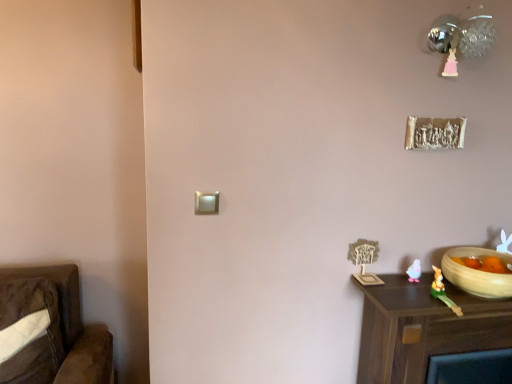
What do you see at coordinates (477, 273) in the screenshot?
I see `beige ceramic bowl at lower right` at bounding box center [477, 273].

Describe the element at coordinates (414, 271) in the screenshot. I see `pink plastic toy at lower right, marked as the first toy in a back-to-front arrangement` at that location.

Where is `metallic sphere at upper right`? This screenshot has width=512, height=384. metallic sphere at upper right is located at coordinates (460, 38).

Which is in front, point (489, 336) or point (486, 26)?

The point (486, 26) is more forward.

Is brown wood nightstand at lower right inside the boundaries of metallic sphere at upper right, or outside?

brown wood nightstand at lower right cannot be found inside metallic sphere at upper right.

Based on the photo, which of these two, brown wood nightstand at lower right or metallic sphere at upper right, stands taller?

With more height is brown wood nightstand at lower right.

Which is correct: beige ceramic bowl at lower right is inside pink plastic toy at lower right, marked as the first toy in a back-to-front arrangement, or outside of it?

beige ceramic bowl at lower right is outside pink plastic toy at lower right, marked as the first toy in a back-to-front arrangement.

Measure the distance between beige ceramic bowl at lower right and pink plastic toy at lower right, the 2th toy when ordered from front to back.

A distance of 20.96 centimeters exists between beige ceramic bowl at lower right and pink plastic toy at lower right, the 2th toy when ordered from front to back.

Looking at this image, which is behind, beige ceramic bowl at lower right or pink plastic toy at lower right, the 2th toy when ordered from front to back?

pink plastic toy at lower right, the 2th toy when ordered from front to back.

From a real-world perspective, is metallic sphere at upper right above or below pink plastic toy at lower right, the 2th toy when ordered from front to back?

In terms of real-world spatial position, metallic sphere at upper right is above pink plastic toy at lower right, the 2th toy when ordered from front to back.

Would you say pink plastic toy at lower right, the 2th toy when ordered from front to back, is part of metallic sphere at upper right's contents?

Definitely not — pink plastic toy at lower right, the 2th toy when ordered from front to back, is not inside metallic sphere at upper right.

In terms of height, does metallic sphere at upper right look taller or shorter compared to pink plastic toy at lower right, marked as the first toy in a back-to-front arrangement?

Clearly, metallic sphere at upper right is taller compared to pink plastic toy at lower right, marked as the first toy in a back-to-front arrangement.

Does point (478, 18) appear closer or farther from the camera than point (414, 273)?

Point (478, 18) is closer to the camera than point (414, 273).

Is brown wood nightstand at lower right facing towards beige ceramic bowl at lower right?

No, brown wood nightstand at lower right is not oriented towards beige ceramic bowl at lower right.

What's the angular difference between brown wood nightstand at lower right and beige ceramic bowl at lower right's facing directions?

The facing directions of brown wood nightstand at lower right and beige ceramic bowl at lower right are 0.721 degrees apart.

Is brown wood nightstand at lower right not inside beige ceramic bowl at lower right?

Yes.

Is brown wood nightstand at lower right far from beige ceramic bowl at lower right?

That's not correct — brown wood nightstand at lower right is a little close to beige ceramic bowl at lower right.

Which object is thinner, pink plastic toy at lower right, the 2th toy when ordered from front to back, or brown wood nightstand at lower right?

Thinner between the two is pink plastic toy at lower right, the 2th toy when ordered from front to back.

From a real-world perspective, who is located lower, pink plastic toy at lower right, marked as the first toy in a back-to-front arrangement, or brown wood nightstand at lower right?

From a 3D spatial view, brown wood nightstand at lower right is below.

Does pink plastic toy at lower right, the 2th toy when ordered from front to back, lie in front of brown wood nightstand at lower right?

No, pink plastic toy at lower right, the 2th toy when ordered from front to back, is further to the viewer.

Looking at this image, which of these two, pink plastic toy at lower right, marked as the first toy in a back-to-front arrangement, or beige ceramic bowl at lower right, stands taller?

beige ceramic bowl at lower right is taller.

Is pink plastic toy at lower right, the 2th toy when ordered from front to back, in contact with beige ceramic bowl at lower right?

No, pink plastic toy at lower right, the 2th toy when ordered from front to back, is not touching beige ceramic bowl at lower right.

Which is more to the left, pink plastic toy at lower right, marked as the first toy in a back-to-front arrangement, or beige ceramic bowl at lower right?

pink plastic toy at lower right, marked as the first toy in a back-to-front arrangement, is more to the left.

Is green rubber rabbit at lower right, arranged as the 1th toy when viewed from the front, facing towards brown wood nightstand at lower right?

No, green rubber rabbit at lower right, arranged as the 1th toy when viewed from the front, is not facing towards brown wood nightstand at lower right.

In terms of size, does green rubber rabbit at lower right, which appears as the 2th toy when viewed from the back, appear bigger or smaller than brown wood nightstand at lower right?

Clearly, green rubber rabbit at lower right, which appears as the 2th toy when viewed from the back, is smaller in size than brown wood nightstand at lower right.

Can you confirm if green rubber rabbit at lower right, which appears as the 2th toy when viewed from the back, is thinner than brown wood nightstand at lower right?

Yes.

Can you confirm if green rubber rabbit at lower right, which appears as the 2th toy when viewed from the back, is positioned to the right of brown wood nightstand at lower right?

No, green rubber rabbit at lower right, which appears as the 2th toy when viewed from the back, is not to the right of brown wood nightstand at lower right.

You are a GUI agent. You are given a task and a screenshot of the screen. Output one action in this format:
    pyautogui.click(x=<x>, y=<y>)
    Task: Click on the light fixture in front of the brown wood nightstand at lower right
    
    Given the screenshot: What is the action you would take?
    click(x=460, y=38)

You are a GUI agent. You are given a task and a screenshot of the screen. Output one action in this format:
    pyautogui.click(x=<x>, y=<y>)
    Task: Click on the 2nd toy to the left of the beige ceramic bowl at lower right, counting from the anchor's position
    
    Given the screenshot: What is the action you would take?
    pyautogui.click(x=414, y=271)

Looking at the image, which one is located closer to green rubber rabbit at lower right, which appears as the 2th toy when viewed from the back, brown wood nightstand at lower right or pink plastic toy at lower right, the 2th toy when ordered from front to back?

pink plastic toy at lower right, the 2th toy when ordered from front to back, is positioned closer to the anchor green rubber rabbit at lower right, which appears as the 2th toy when viewed from the back.

Looking at the image, which one is located further to brown wood nightstand at lower right, pink plastic toy at lower right, marked as the first toy in a back-to-front arrangement, or metallic sphere at upper right?

metallic sphere at upper right is further to brown wood nightstand at lower right.

Considering their positions, is beige ceramic bowl at lower right positioned closer to pink plastic toy at lower right, the 2th toy when ordered from front to back, than brown wood nightstand at lower right?

The object closer to pink plastic toy at lower right, the 2th toy when ordered from front to back, is beige ceramic bowl at lower right.

From the image, which object appears to be farther from brown wood nightstand at lower right, beige ceramic bowl at lower right or green rubber rabbit at lower right, arranged as the 1th toy when viewed from the front?

The object further to brown wood nightstand at lower right is beige ceramic bowl at lower right.

When comparing their distances from pink plastic toy at lower right, marked as the first toy in a back-to-front arrangement, does beige ceramic bowl at lower right or green rubber rabbit at lower right, arranged as the 1th toy when viewed from the front, seem closer?

Based on the image, green rubber rabbit at lower right, arranged as the 1th toy when viewed from the front, appears to be nearer to pink plastic toy at lower right, marked as the first toy in a back-to-front arrangement.

When comparing their distances from green rubber rabbit at lower right, arranged as the 1th toy when viewed from the front, does pink plastic toy at lower right, marked as the first toy in a back-to-front arrangement, or brown wood nightstand at lower right seem further?

brown wood nightstand at lower right is further to green rubber rabbit at lower right, arranged as the 1th toy when viewed from the front.

Estimate the real-world distances between objects in this image. Which object is further from green rubber rabbit at lower right, arranged as the 1th toy when viewed from the front, beige ceramic bowl at lower right or metallic sphere at upper right?

The object further to green rubber rabbit at lower right, arranged as the 1th toy when viewed from the front, is metallic sphere at upper right.

From the image, which object appears to be farther from pink plastic toy at lower right, the 2th toy when ordered from front to back, metallic sphere at upper right or beige ceramic bowl at lower right?

metallic sphere at upper right.

Where is `toy between beige ceramic bowl at lower right and brown wood nightstand at lower right in the up-down direction`? This screenshot has width=512, height=384. toy between beige ceramic bowl at lower right and brown wood nightstand at lower right in the up-down direction is located at coordinates (443, 292).

Identify the location of toy that lies between metallic sphere at upper right and beige ceramic bowl at lower right from top to bottom. (414, 271).

Where is `bowl between metallic sphere at upper right and green rubber rabbit at lower right, which appears as the 2th toy when viewed from the back, vertically`? This screenshot has width=512, height=384. bowl between metallic sphere at upper right and green rubber rabbit at lower right, which appears as the 2th toy when viewed from the back, vertically is located at coordinates (477, 273).

In order to click on toy between pink plastic toy at lower right, the 2th toy when ordered from front to back, and brown wood nightstand at lower right in the up-down direction in this screenshot , I will do `click(443, 292)`.